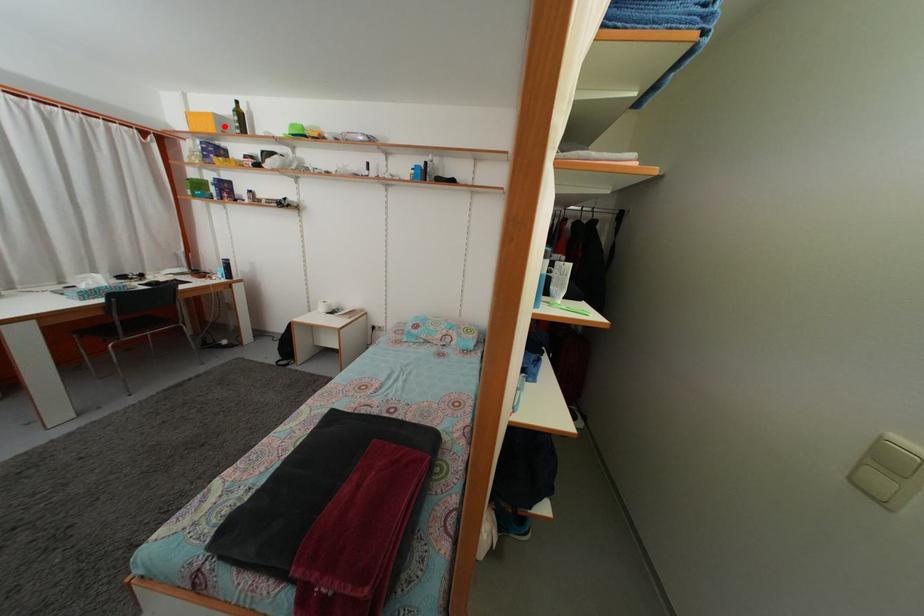
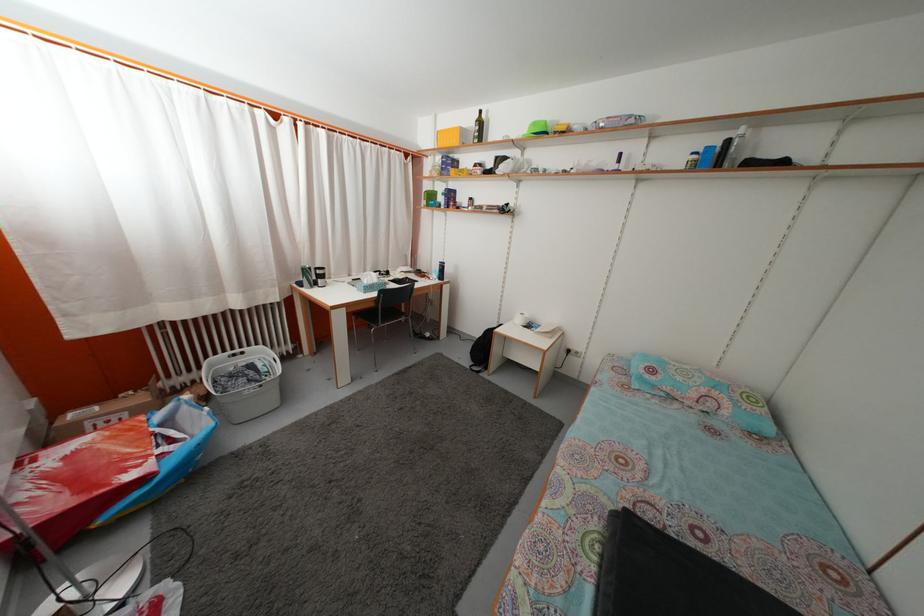
In the second image, find the point that corresponds to the highlighted location in the first image.

(468, 139)